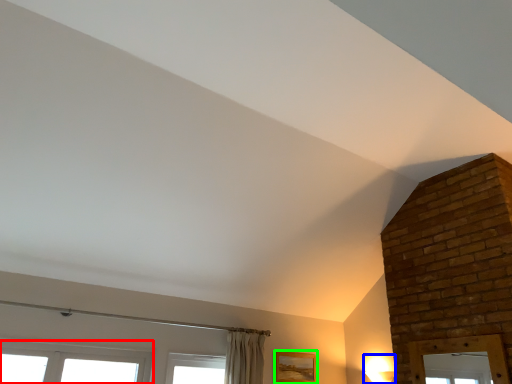
Question: Which object is positioned closest to window (highlighted by a red box)? Select from light fixture (highlighted by a blue box) and picture frame (highlighted by a green box).

Choices:
 (A) light fixture
 (B) picture frame

Answer: (B)